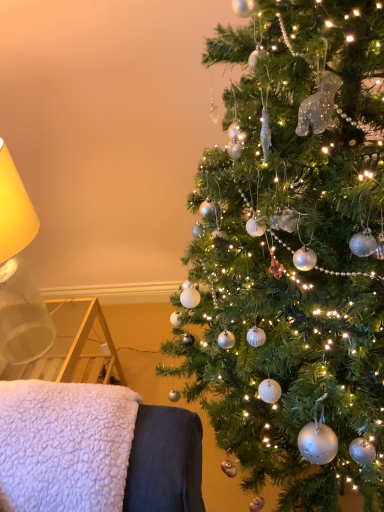
Question: In terms of size, does translucent glass lampshade at left appear bigger or smaller than white fluffy blanket at lower left?

Choices:
 (A) small
 (B) big

Answer: (B)

Question: Looking at their shapes, would you say translucent glass lampshade at left is wider or thinner than white fluffy blanket at lower left?

Choices:
 (A) thin
 (B) wide

Answer: (A)

Question: Estimate the real-world distances between objects in this image. Which object is closer to the translucent glass lampshade at left?

Choices:
 (A) shiny silver ornaments at right
 (B) white fluffy blanket at lower left

Answer: (B)

Question: Which of these objects is positioned farthest from the shiny silver ornaments at right?

Choices:
 (A) translucent glass lampshade at left
 (B) white fluffy blanket at lower left

Answer: (A)